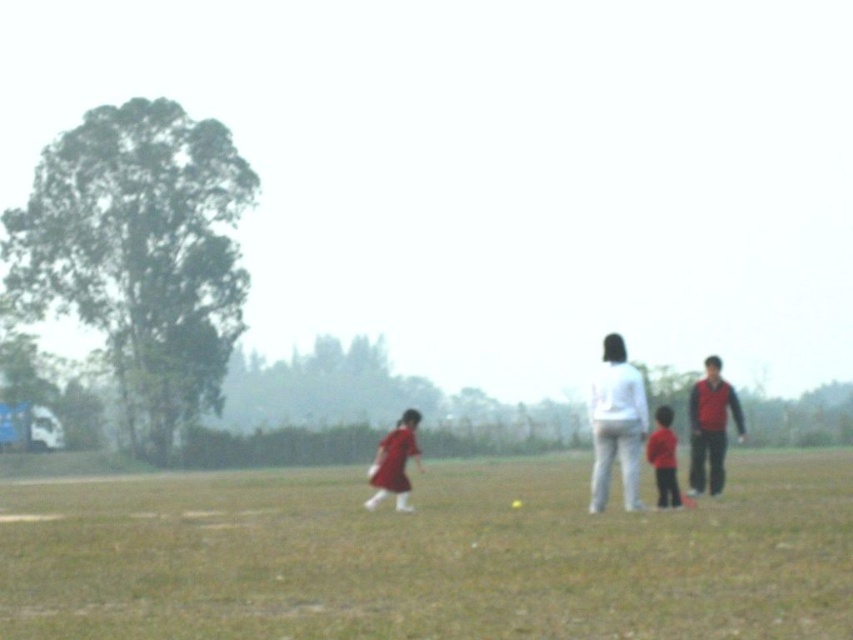
Can you confirm if matte red dress at center is positioned to the right of matte red shirt at center?

Incorrect, matte red dress at center is not on the right side of matte red shirt at center.

Which is more to the left, matte red dress at center or matte red shirt at center?

Positioned to the left is matte red dress at center.

Which is in front, point (404, 512) or point (666, 500)?

Positioned in front is point (666, 500).

Find the location of `matte red dress at center`. matte red dress at center is located at coordinates (395, 461).

Measure the distance from red fabric jacket at right to matte red dress at center.

red fabric jacket at right is 5.66 meters from matte red dress at center.

Between red fabric jacket at right and matte red dress at center, which one has more height?

Standing taller between the two is red fabric jacket at right.

Describe the element at coordinates (711, 428) in the screenshot. I see `red fabric jacket at right` at that location.

Where is `red fabric jacket at right`? red fabric jacket at right is located at coordinates (711, 428).

Who is more distant from viewer, (x=595, y=381) or (x=602, y=436)?

The point (x=595, y=381) is more distant.

Is white cotton pants at right positioned in front of white matte pants at center?

That is False.

Describe the element at coordinates (616, 422) in the screenshot. I see `white cotton pants at right` at that location.

I want to click on white cotton pants at right, so click(x=616, y=422).